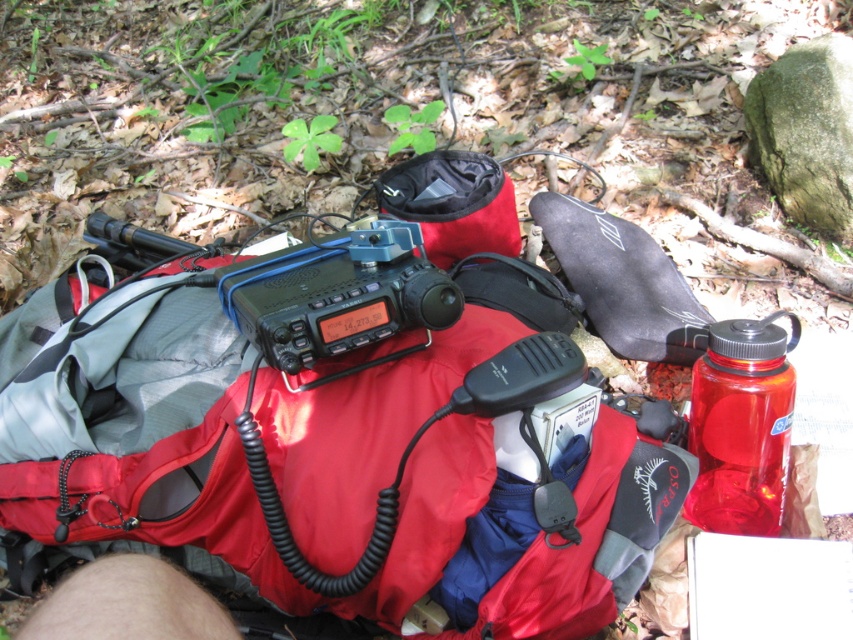
Who is higher up, matte nylon backpack at center or transparent plastic bottle at center-right?

matte nylon backpack at center is higher up.

Is matte nylon backpack at center in front of transparent plastic bottle at center-right?

Yes, it is.

Between point (521, 276) and point (764, 486), which one is positioned behind?

Positioned behind is point (521, 276).

Find the location of a particular element. The height and width of the screenshot is (640, 853). matte nylon backpack at center is located at coordinates pyautogui.click(x=341, y=444).